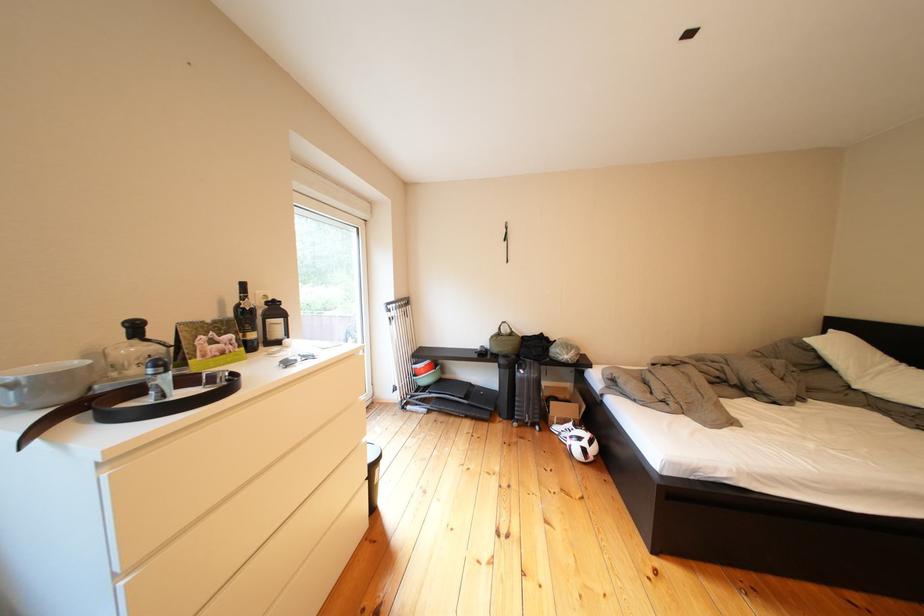
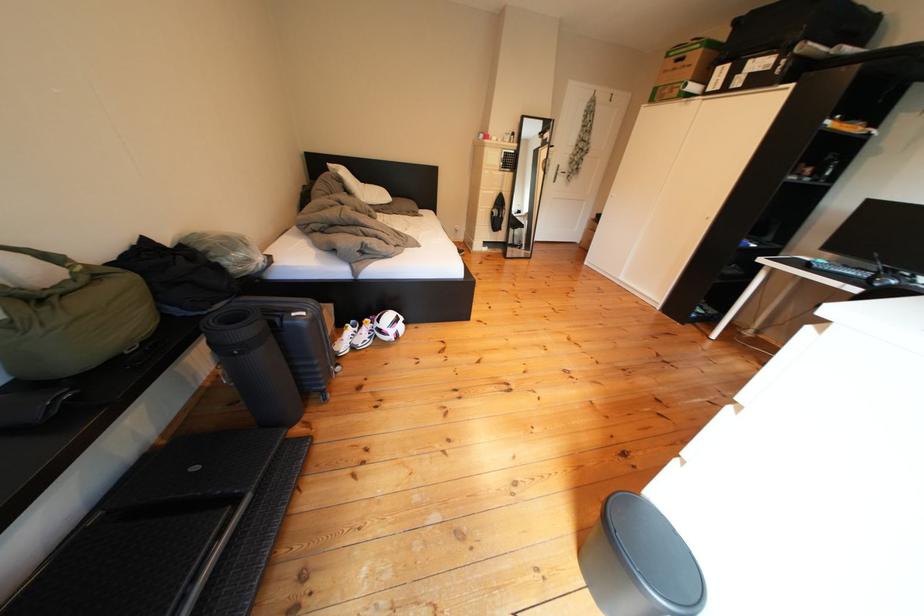
Where in the second image is the point corresponding to pixel 536 377 from the first image?

(317, 318)